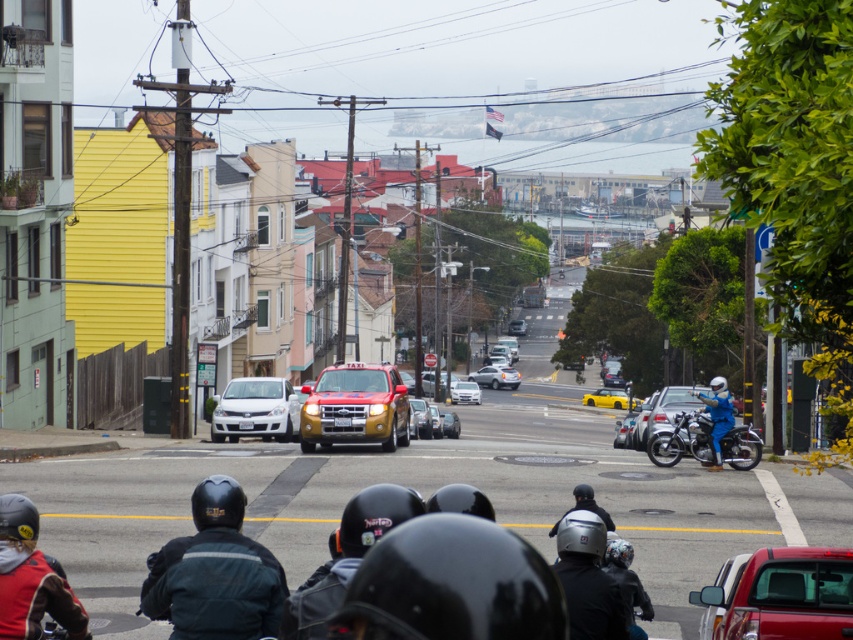
You are a pedestrian standing on the sidewalk and want to cross the street. There is a metallic silver motorcycle at right and a satin silver sedan at center. Which vehicle is taller and might be harder to see over when crossing?

The metallic silver motorcycle at right is taller than the satin silver sedan at center, so it might be harder to see over when crossing.

You are a pedestrian trying to cross the street from the left side. There is a shiny metallic motorcycle at right and a satin silver sedan at center. Which vehicle will you encounter first as you cross the street?

The shiny metallic motorcycle at right is in front of the satin silver sedan at center, so you will encounter the shiny metallic motorcycle at right first as you cross the street.

You are a pedestrian trying to cross the street safely. You see the metallic silver motorcycle at right and the yellow matte convertible at center. Which vehicle should you avoid first while crossing?

You should avoid the metallic silver motorcycle at right first because it is in front of the yellow matte convertible at center, meaning it is closer to you and poses an immediate danger.